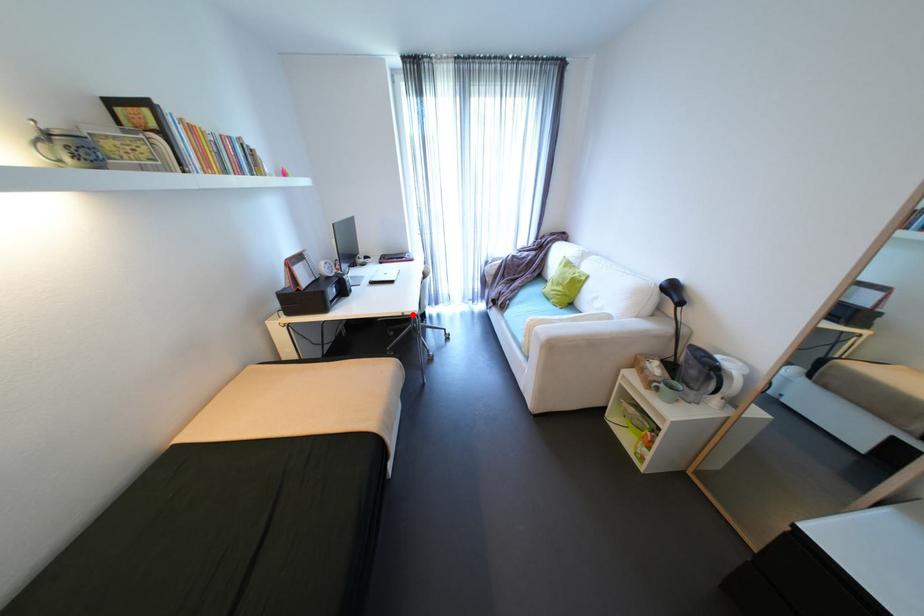
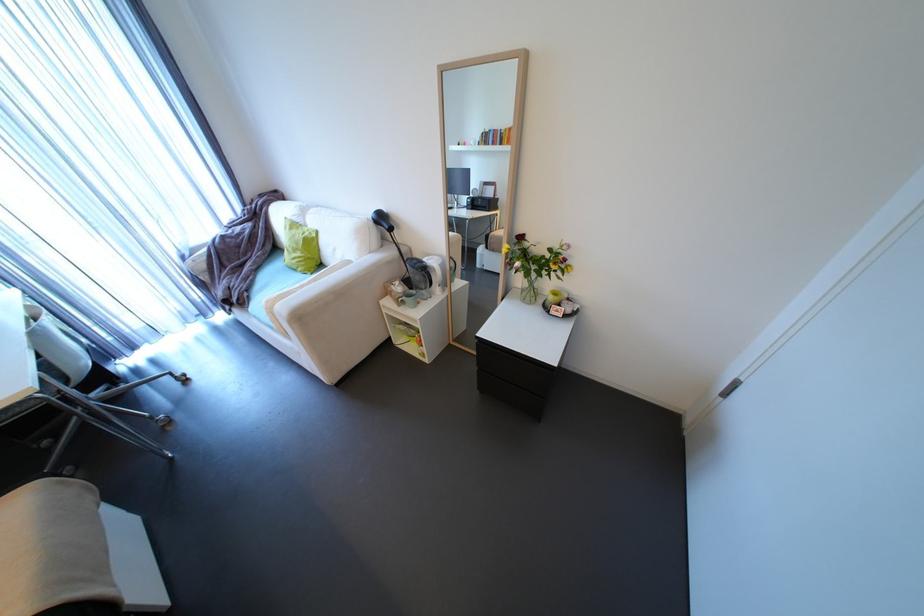
Question: I am providing you with two images of the same scene from different viewpoints. In image1, a red point is highlighted. Considering the same 3D point in image2, which of the following is correct?

Choices:
 (A) It is closer
 (B) It is farther

Answer: (B)